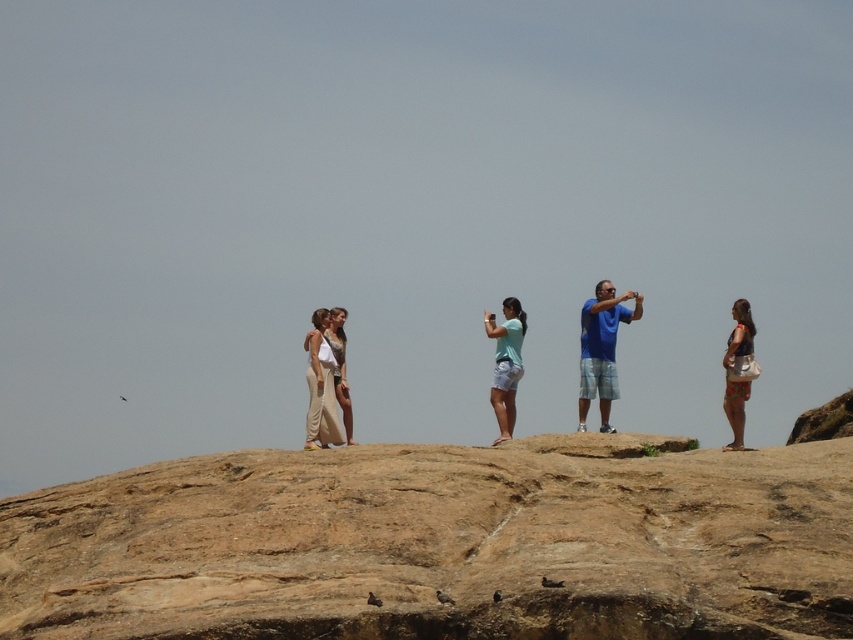
Which of these two, beige fabric dress at center or floral print shorts at right, stands taller?

floral print shorts at right is taller.

Looking at this image, is beige fabric dress at center positioned at the back of floral print shorts at right?

Yes, it is.

Is point (329, 323) more distant than point (727, 362)?

Yes, it is behind point (727, 362).

Identify the location of beige fabric dress at center. The height and width of the screenshot is (640, 853). (321, 387).

Between point (585, 342) and point (732, 387), which one is positioned behind?

The point (585, 342) is more distant.

You are a GUI agent. You are given a task and a screenshot of the screen. Output one action in this format:
    pyautogui.click(x=<x>, y=<y>)
    Task: Click on the blue cotton shirt at center
    Image resolution: width=853 pixels, height=640 pixels.
    Given the screenshot: What is the action you would take?
    tap(601, 348)

Find the location of `blue cotton shirt at center`. blue cotton shirt at center is located at coordinates (601, 348).

Can you confirm if brown rock cliff at center is positioned to the right of blue cotton shirt at center?

No, brown rock cliff at center is not to the right of blue cotton shirt at center.

Is point (321, 556) in front of point (583, 333)?

Yes, point (321, 556) is closer to viewer.

This screenshot has width=853, height=640. Identify the location of brown rock cliff at center. (440, 545).